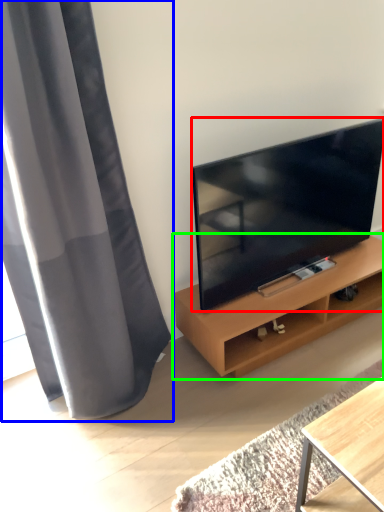
Question: Which object is the farthest from television (highlighted by a red box)? Choose among these: curtain (highlighted by a blue box) or shelf (highlighted by a green box).

Choices:
 (A) curtain
 (B) shelf

Answer: (A)